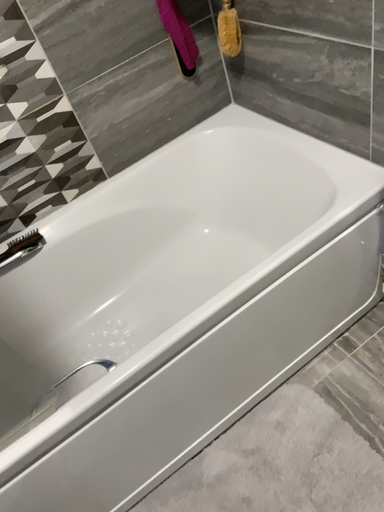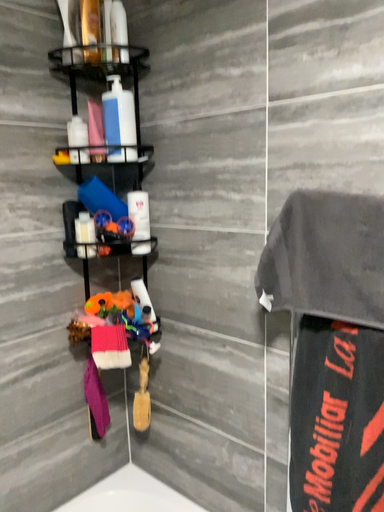
Question: Which way did the camera rotate in the video?

Choices:
 (A) rotated right
 (B) rotated left

Answer: (A)